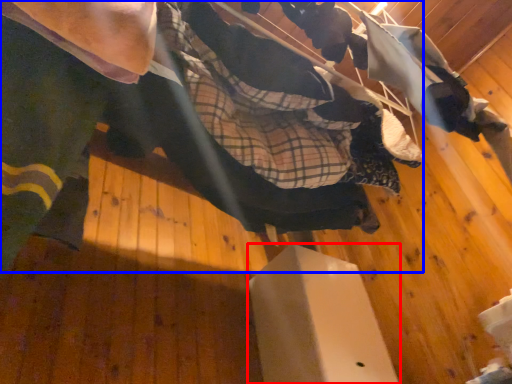
Question: Which of the following is the closest to the observer, furniture (highlighted by a red box) or skateboarder (highlighted by a blue box)?

Choices:
 (A) furniture
 (B) skateboarder

Answer: (B)